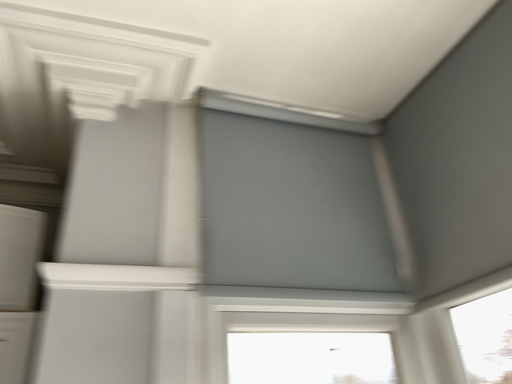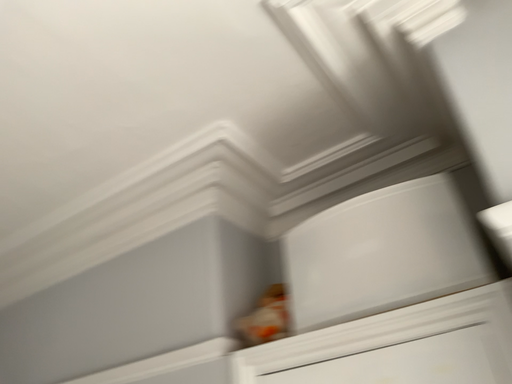
Question: How did the camera likely rotate when shooting the video?

Choices:
 (A) rotated upward
 (B) rotated downward

Answer: (B)